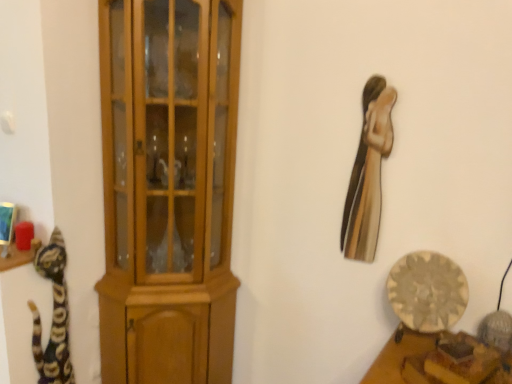
Question: Would you say multicolored fur cat at left is outside metallic gold statue at upper right?

Choices:
 (A) no
 (B) yes

Answer: (B)

Question: Is multicolored fur cat at left positioned behind metallic gold statue at upper right?

Choices:
 (A) no
 (B) yes

Answer: (B)

Question: From a real-world perspective, is multicolored fur cat at left positioned under metallic gold statue at upper right based on gravity?

Choices:
 (A) no
 (B) yes

Answer: (B)

Question: Is multicolored fur cat at left to the right of metallic gold statue at upper right from the viewer's perspective?

Choices:
 (A) no
 (B) yes

Answer: (A)

Question: Does multicolored fur cat at left have a greater width compared to metallic gold statue at upper right?

Choices:
 (A) no
 (B) yes

Answer: (B)

Question: In the image, is wooden plate at lower right on the left side or the right side of light brown wood cupboard at left?

Choices:
 (A) left
 (B) right

Answer: (B)

Question: Does point (476, 339) appear closer or farther from the camera than point (208, 97)?

Choices:
 (A) closer
 (B) farther

Answer: (A)

Question: In the image, is wooden plate at lower right positioned in front of or behind light brown wood cupboard at left?

Choices:
 (A) front
 (B) behind

Answer: (A)

Question: Is wooden plate at lower right inside the boundaries of light brown wood cupboard at left, or outside?

Choices:
 (A) inside
 (B) outside

Answer: (B)

Question: In terms of width, does metallic gold statue at upper right look wider or thinner when compared to light brown wood cupboard at left?

Choices:
 (A) wide
 (B) thin

Answer: (B)

Question: From the image's perspective, is metallic gold statue at upper right above or below light brown wood cupboard at left?

Choices:
 (A) below
 (B) above

Answer: (B)

Question: From a real-world perspective, is metallic gold statue at upper right positioned above or below light brown wood cupboard at left?

Choices:
 (A) above
 (B) below

Answer: (A)

Question: Is metallic gold statue at upper right spatially inside light brown wood cupboard at left, or outside of it?

Choices:
 (A) outside
 (B) inside

Answer: (A)

Question: Considering the positions of multicolored fur cat at left and light brown wood cupboard at left in the image, is multicolored fur cat at left wider or thinner than light brown wood cupboard at left?

Choices:
 (A) wide
 (B) thin

Answer: (B)

Question: Based on their positions, is multicolored fur cat at left located to the left or right of light brown wood cupboard at left?

Choices:
 (A) right
 (B) left

Answer: (B)